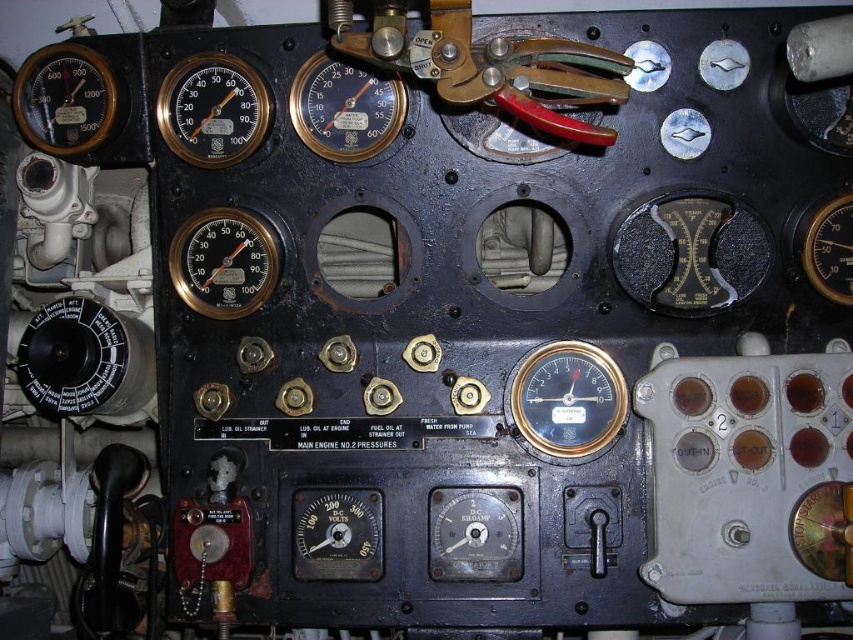
Question: Is matte black gauge at center thinner than black metallic gauge at right?

Choices:
 (A) yes
 (B) no

Answer: (B)

Question: Can you confirm if matte brass gauge at center-left is positioned above matte black gauge at center?

Choices:
 (A) yes
 (B) no

Answer: (B)

Question: Which point is closer to the camera taking this photo?

Choices:
 (A) (202, 120)
 (B) (32, 84)
 (C) (831, 273)

Answer: (C)

Question: Which point is farther to the camera?

Choices:
 (A) brass/red handle valve at upper center
 (B) matte black gauge at upper left
 (C) matte black gauge at center
 (D) black metallic gauge at right

Answer: (B)

Question: Can you confirm if matte black gauge at center right is smaller than matte black gauge at center?

Choices:
 (A) no
 (B) yes

Answer: (A)

Question: Which object is closer to the camera taking this photo?

Choices:
 (A) matte brass gauge at center-left
 (B) matte black gauge at center right
 (C) matte gold gauge at upper left
 (D) matte black gauge at upper left

Answer: (B)